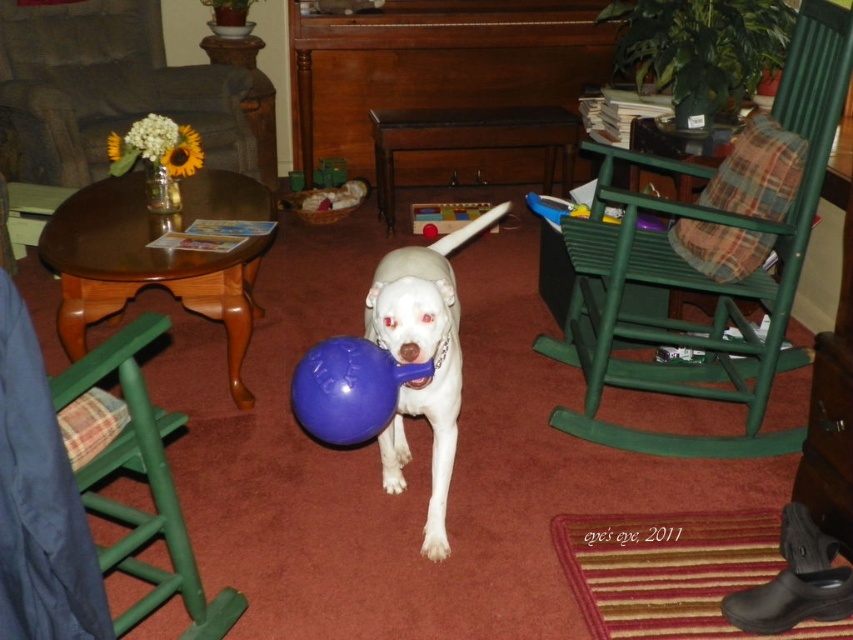
Question: Does green wood rocking chair at center right have a larger size compared to green wood rocking chair at lower left?

Choices:
 (A) yes
 (B) no

Answer: (A)

Question: Which object is farther from the camera taking this photo?

Choices:
 (A) green wood rocking chair at lower left
 (B) white glossy dog at center
 (C) green wood rocking chair at center right
 (D) rubber blue ball at center

Answer: (C)

Question: Is green wood rocking chair at center right to the left of white glossy dog at center from the viewer's perspective?

Choices:
 (A) yes
 (B) no

Answer: (B)

Question: Which point is farther to the camera?

Choices:
 (A) (383, 342)
 (B) (363, 358)
 (C) (579, 333)
 (D) (28, 388)

Answer: (C)

Question: Among these points, which one is nearest to the camera?

Choices:
 (A) (421, 342)
 (B) (293, 404)

Answer: (A)

Question: Does green wood rocking chair at center right have a lesser width compared to green wood rocking chair at lower left?

Choices:
 (A) yes
 (B) no

Answer: (B)